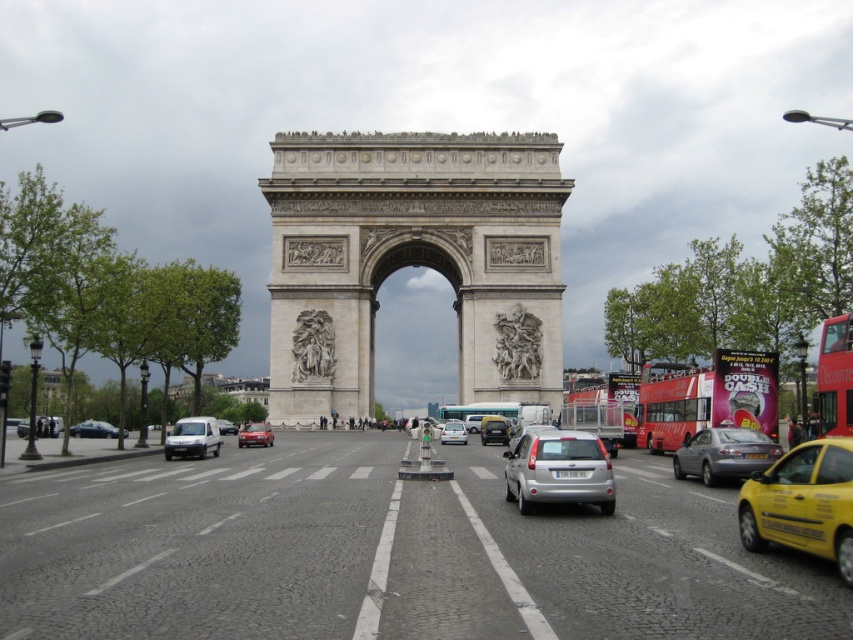
Question: From the image, what is the correct spatial relationship of silver metallic sedan at center in relation to satin silver sedan at center?

Choices:
 (A) right
 (B) left

Answer: (A)

Question: Can you confirm if polished stone relief at center is thinner than white stone sculpture at center?

Choices:
 (A) yes
 (B) no

Answer: (B)

Question: Is metallic silver bus at center behind matte black sedan at left?

Choices:
 (A) no
 (B) yes

Answer: (A)

Question: Which point is farther from the camera taking this photo?

Choices:
 (A) (538, 412)
 (B) (184, 422)
 (C) (456, 428)
 (D) (497, 436)

Answer: (C)

Question: Which point is farther to the camera?

Choices:
 (A) (54, 426)
 (B) (515, 376)

Answer: (A)

Question: Which of the following is the farthest from the observer?

Choices:
 (A) (833, 317)
 (B) (462, 428)

Answer: (B)